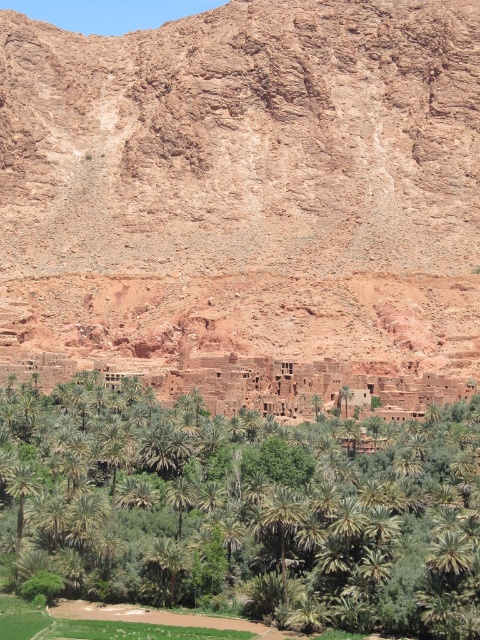
Is point (247, 304) in front of point (472, 454)?

No, (247, 304) is behind (472, 454).

Can you confirm if brown rock formation at center is bigger than green leafy palm at center?

Correct, brown rock formation at center is larger in size than green leafy palm at center.

The image size is (480, 640). In order to click on brown rock formation at center in this screenshot , I will do `click(245, 184)`.

This screenshot has height=640, width=480. Identify the location of brown rock formation at center. (245, 184).

Who is more distant from viewer, (105, 216) or (36, 477)?

Positioned behind is point (105, 216).

What do you see at coordinates (245, 184) in the screenshot?
I see `brown rock formation at center` at bounding box center [245, 184].

Where is `brown rock formation at center`? Image resolution: width=480 pixels, height=640 pixels. brown rock formation at center is located at coordinates (245, 184).

Does green leafy palm at center appear over green leafy palm tree at lower left?

Yes.

Is point (332, 602) farther from viewer compared to point (17, 468)?

No, (332, 602) is in front of (17, 468).

Find the location of a particular element. green leafy palm at center is located at coordinates (252, 508).

Identify the location of green leafy palm at center. pos(252,508).